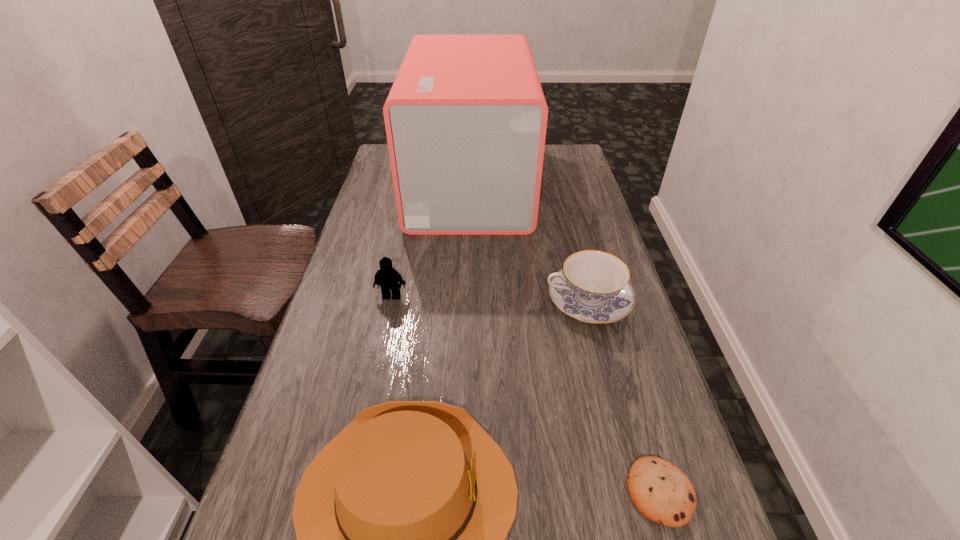
Identify the location of box. The width and height of the screenshot is (960, 540). (466, 117).

Locate an element on the screen. The height and width of the screenshot is (540, 960). the tallest object is located at coordinates (466, 117).

At what (x,y) coordinates should I click in order to perform the action: click on Lego. Please return your answer as a coordinate pair (x, y). The image size is (960, 540). Looking at the image, I should click on (387, 277).

I want to click on chinaware, so click(593, 286).

This screenshot has height=540, width=960. Identify the location of the shortest object. (660, 491).

Find the location of a particular element. The height and width of the screenshot is (540, 960). vacant space situated on the surface of the box where the text is embossed is located at coordinates (554, 184).

This screenshot has width=960, height=540. I want to click on vacant space situated on the face of the Lego, so click(x=359, y=449).

This screenshot has height=540, width=960. What are the coordinates of `free space located 0.320m with the handle on the side of the chinaware` in the screenshot? It's located at (414, 301).

Find the location of `vacant space located 0.290m with the handle on the side of the chinaware`. vacant space located 0.290m with the handle on the side of the chinaware is located at coordinates (426, 301).

Locate an element on the screen. The width and height of the screenshot is (960, 540). blank space located with the handle on the side of the chinaware is located at coordinates (475, 301).